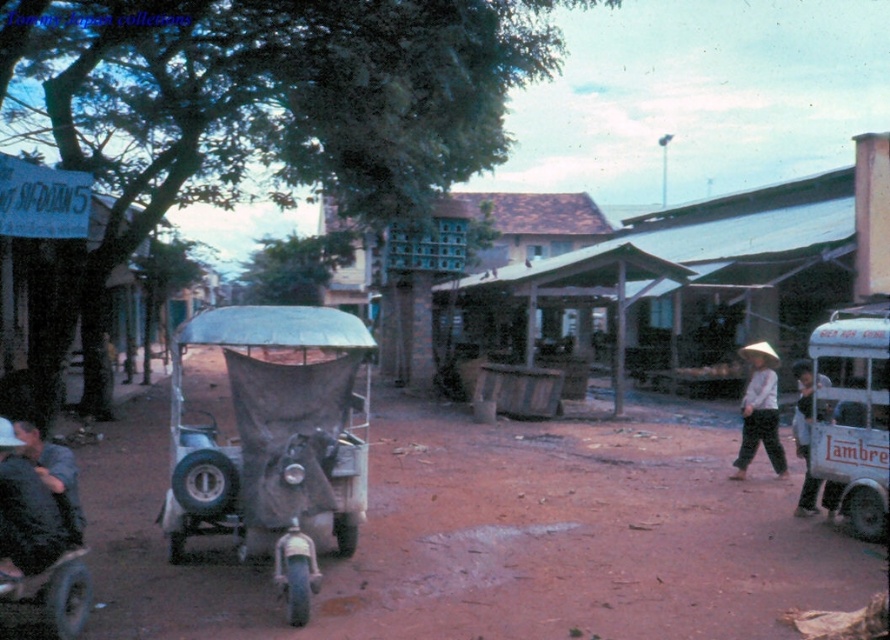
You are a photographer standing in the middle of the street. You want to take a photo that includes both the dark blue shirt at lower left and the white cloth hat at right. Which object should you adjust your camera angle to focus on first to ensure both fit in the frame?

Since the dark blue shirt at lower left is wider than the white cloth hat at right, you should focus on the dark blue shirt at lower left first to ensure both objects fit within the camera frame.

In the scene shown: You are standing on the street and see the brown dirt field at center and the dark blue shirt at lower left. Which object is higher in elevation?

The brown dirt field at center is much taller than the dark blue shirt at lower left, so the brown dirt field at center is higher in elevation.

You are standing at the point marked as point (x=490, y=538) in the image. What surface are you standing on?

The point (x=490, y=538) is on brown dirt field at center, so you are standing on a brown dirt field.